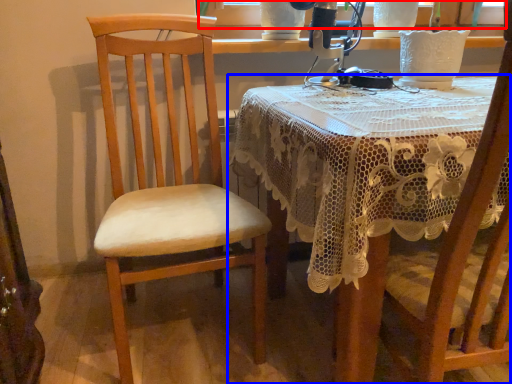
Question: Which of the following is the closest to the observer, window screen (highlighted by a red box) or table (highlighted by a blue box)?

Choices:
 (A) window screen
 (B) table

Answer: (B)